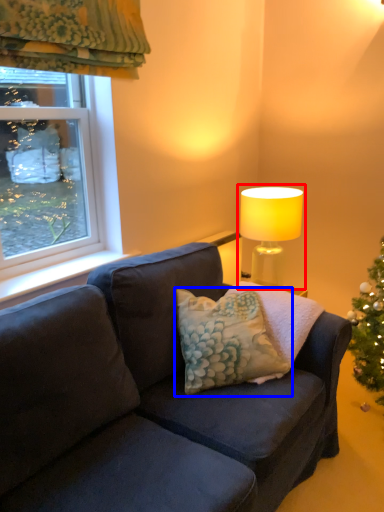
Question: Among these objects, which one is farthest to the camera, lamp (highlighted by a red box) or pillow (highlighted by a blue box)?

Choices:
 (A) lamp
 (B) pillow

Answer: (A)